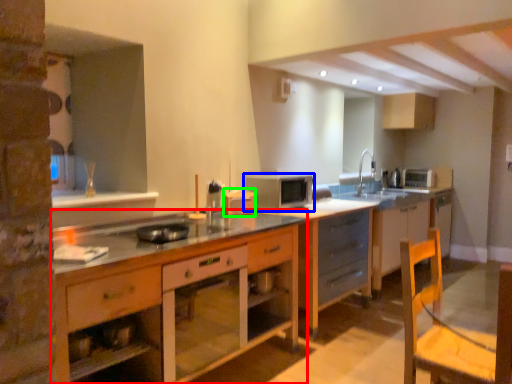
Question: Estimate the real-world distances between objects in this image. Which object is farther from cabinetry (highlighted by a red box), microwave oven (highlighted by a blue box) or appliance (highlighted by a green box)?

Choices:
 (A) microwave oven
 (B) appliance

Answer: (A)